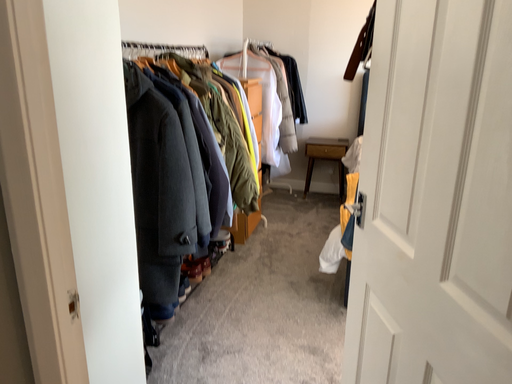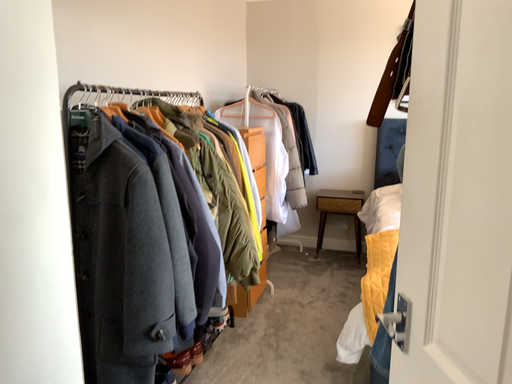
Question: How did the camera likely rotate when shooting the video?

Choices:
 (A) rotated downward
 (B) rotated upward

Answer: (B)